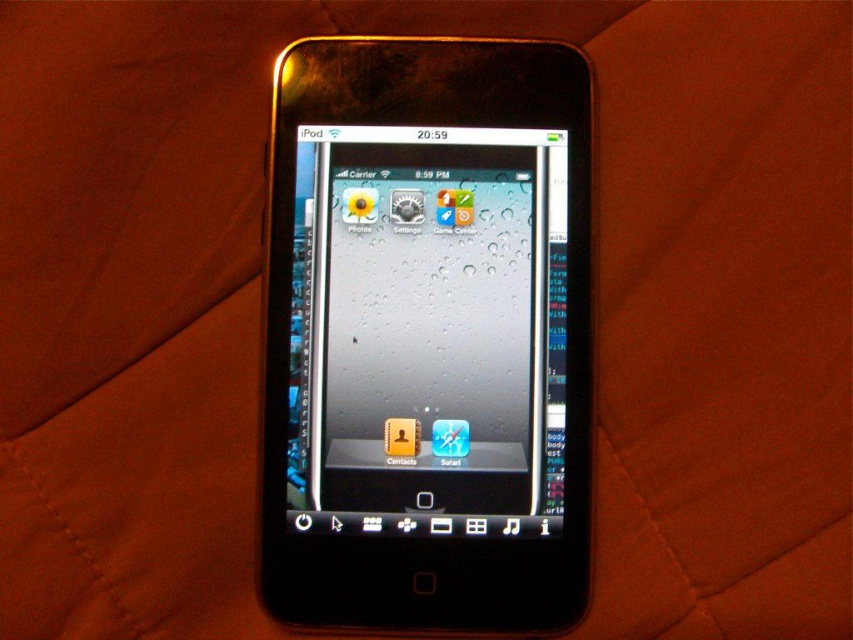
Question: Among these objects, which one is farthest from the camera?

Choices:
 (A) black glossy smartphone at center
 (B) glossy plastic screen at center

Answer: (B)

Question: Which of the following is the closest to the observer?

Choices:
 (A) (364, 237)
 (B) (468, 321)

Answer: (B)

Question: Can you confirm if black glossy smartphone at center is thinner than glossy plastic screen at center?

Choices:
 (A) yes
 (B) no

Answer: (B)

Question: Is black glossy smartphone at center wider than glossy plastic screen at center?

Choices:
 (A) no
 (B) yes

Answer: (B)

Question: Can you confirm if black glossy smartphone at center is positioned above glossy plastic screen at center?

Choices:
 (A) no
 (B) yes

Answer: (A)

Question: Which point is closer to the camera?

Choices:
 (A) black glossy smartphone at center
 (B) glossy plastic screen at center

Answer: (A)